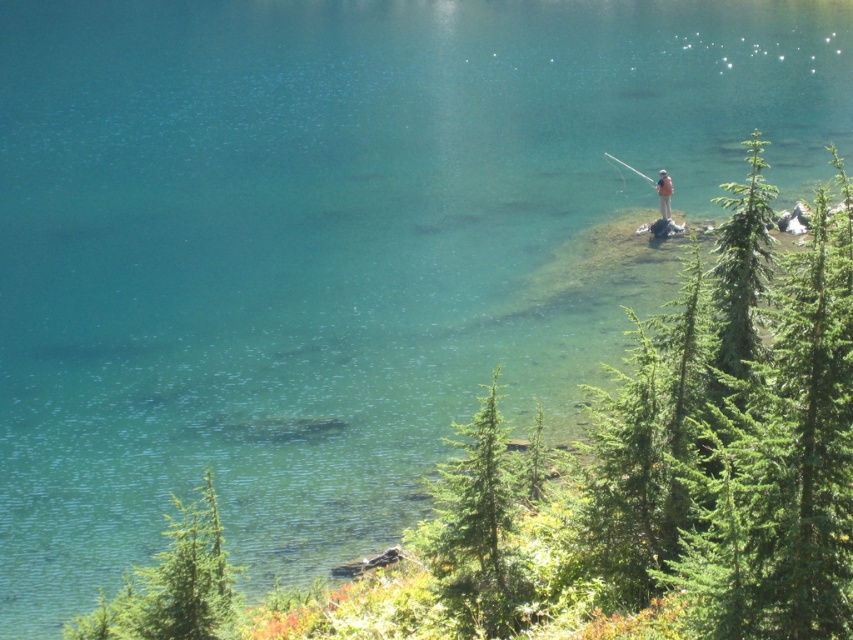
You are standing at the lakeside and see two points marked in the image. The first point is at coordinate point[520,566] and the second is at point[662,188]. Which point is closer to you?

Point[520,566] is in front of point[662,188], so it is closer to you.

You are standing at the edge of the lake and want to take a photo of both the green matte tree at lower center and the green matte tree at lower left. Which tree should you focus on first if you want to include both in your frame without moving the camera?

You should focus on the green matte tree at lower center first because it is taller than the green matte tree at lower left, allowing it to be captured within the frame more easily when positioned properly.

You are standing at the edge of the lake and want to take a photo of the camouflage fabric person at center without the green matte tree at lower left blocking the view. Is this possible?

The green matte tree at lower left is closer to the viewer than camouflage fabric person at center, so it may block the view. Move to a position where the tree is not between you and the person.